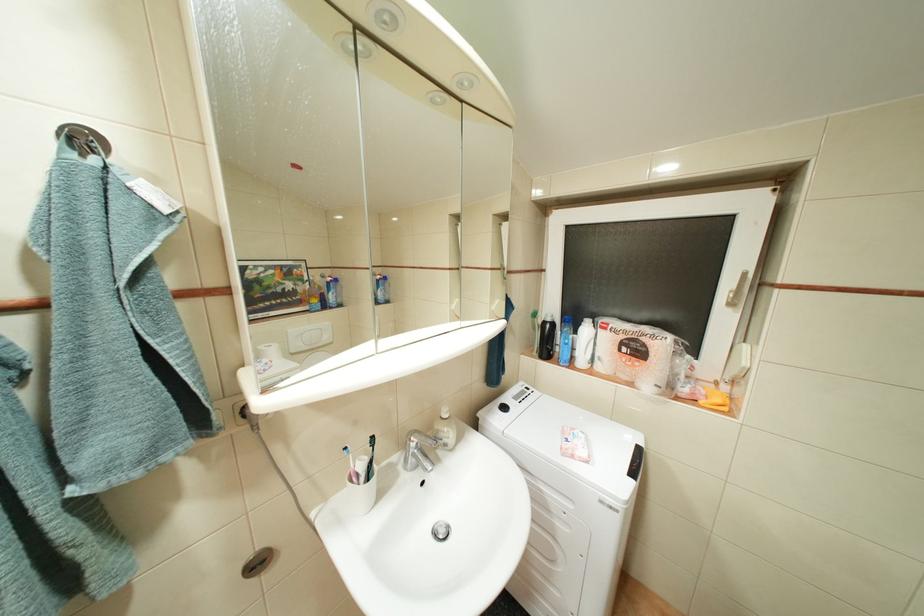
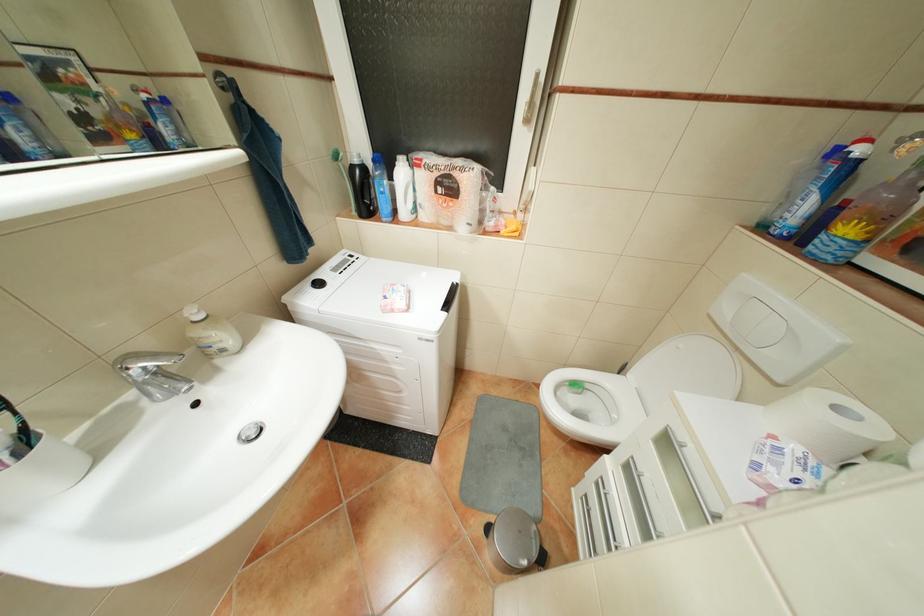
Where in the second image is the point corresponding to [553,322] from the first image?

(361, 167)